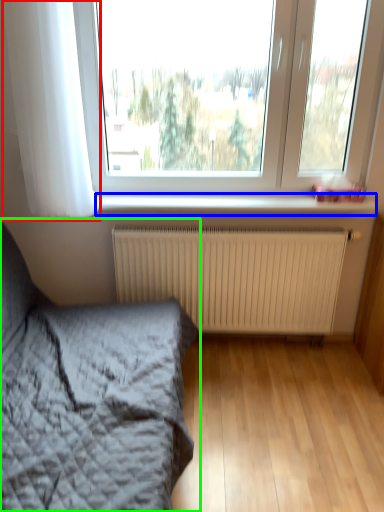
Question: Which is nearer to the curtain (highlighted by a red box)? window sill (highlighted by a blue box) or bed (highlighted by a green box).

Choices:
 (A) window sill
 (B) bed

Answer: (A)